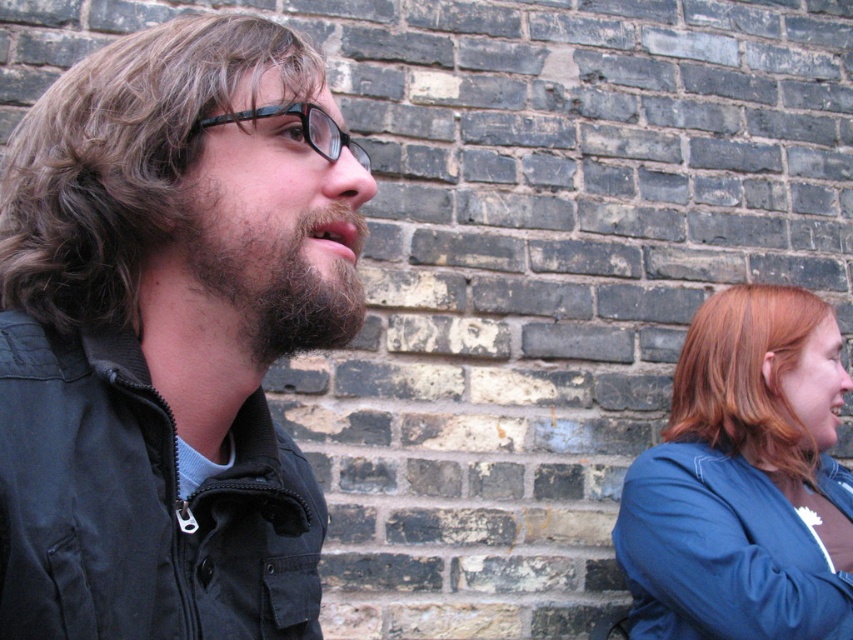
Question: Can you confirm if black cotton jacket at left is bigger than dark brown fuzzy beard at left?

Choices:
 (A) yes
 (B) no

Answer: (A)

Question: Considering the relative positions of matte black jacket at left and black cotton jacket at left in the image provided, where is matte black jacket at left located with respect to black cotton jacket at left?

Choices:
 (A) below
 (B) above

Answer: (B)

Question: Which point appears farthest from the camera in this image?

Choices:
 (A) (743, 305)
 (B) (210, 36)

Answer: (A)

Question: Among these points, which one is farthest from the camera?

Choices:
 (A) (213, 45)
 (B) (227, 556)

Answer: (B)

Question: Which point is closer to the camera taking this photo?

Choices:
 (A) (135, 96)
 (B) (96, 396)
 (C) (154, 406)
 (D) (787, 588)

Answer: (B)

Question: Can you confirm if black cotton jacket at left is positioned above brown curly hair at left?

Choices:
 (A) no
 (B) yes

Answer: (A)